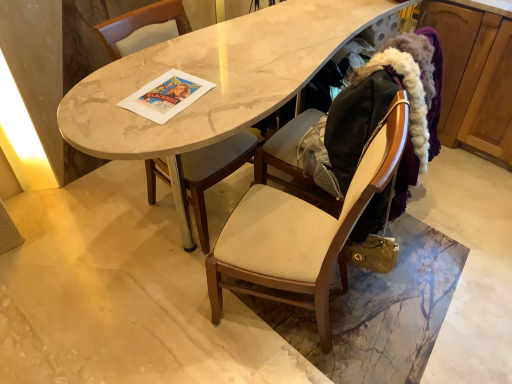
Question: Does beige fabric chair at center, the first chair in the right-to-left sequence, have a smaller size compared to wooden cabinet at right?

Choices:
 (A) yes
 (B) no

Answer: (A)

Question: From the image's perspective, does beige fabric chair at center, the first chair in the right-to-left sequence, appear higher than wooden cabinet at right?

Choices:
 (A) no
 (B) yes

Answer: (A)

Question: Is beige fabric chair at center, marked as the 2th chair in a left-to-right arrangement, bigger than wooden cabinet at right?

Choices:
 (A) yes
 (B) no

Answer: (B)

Question: Does beige fabric chair at center, the first chair in the right-to-left sequence, turn towards wooden cabinet at right?

Choices:
 (A) yes
 (B) no

Answer: (B)

Question: Is beige fabric chair at center, marked as the 2th chair in a left-to-right arrangement, at the left side of wooden cabinet at right?

Choices:
 (A) no
 (B) yes

Answer: (B)

Question: Is beige fabric chair at center, the first chair in the right-to-left sequence, positioned in front of wooden cabinet at right?

Choices:
 (A) yes
 (B) no

Answer: (A)

Question: Is beige fabric chair at center, the first chair in the right-to-left sequence, facing away from matte gray cushioned chair at center, marked as the first chair in a left-to-right arrangement?

Choices:
 (A) no
 (B) yes

Answer: (A)

Question: From a real-world perspective, is beige fabric chair at center, the first chair in the right-to-left sequence, positioned under matte gray cushioned chair at center, which appears as the 2th chair when viewed from the right, based on gravity?

Choices:
 (A) yes
 (B) no

Answer: (B)

Question: From a real-world perspective, is beige fabric chair at center, marked as the 2th chair in a left-to-right arrangement, on top of matte gray cushioned chair at center, marked as the first chair in a left-to-right arrangement?

Choices:
 (A) yes
 (B) no

Answer: (A)

Question: From the image's perspective, does beige fabric chair at center, the first chair in the right-to-left sequence, appear higher than matte gray cushioned chair at center, which appears as the 2th chair when viewed from the right?

Choices:
 (A) no
 (B) yes

Answer: (A)

Question: Is beige fabric chair at center, marked as the 2th chair in a left-to-right arrangement, wider than matte gray cushioned chair at center, marked as the first chair in a left-to-right arrangement?

Choices:
 (A) yes
 (B) no

Answer: (A)

Question: Is beige fabric chair at center, the first chair in the right-to-left sequence, surrounding matte gray cushioned chair at center, which appears as the 2th chair when viewed from the right?

Choices:
 (A) no
 (B) yes

Answer: (A)

Question: Does beige fabric chair at center, the first chair in the right-to-left sequence, appear on the right side of marble table at center?

Choices:
 (A) yes
 (B) no

Answer: (B)